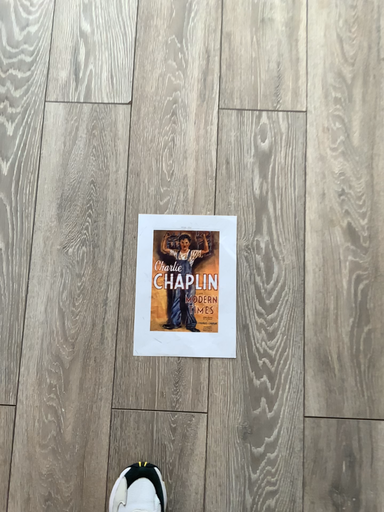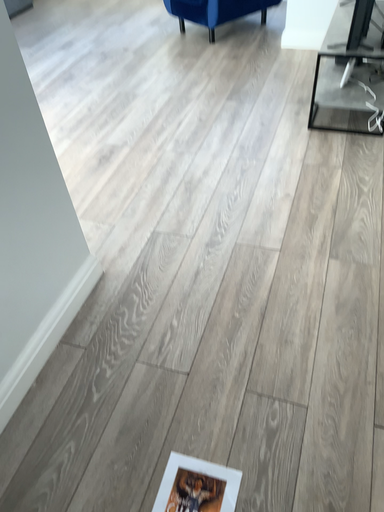
Question: Which way did the camera rotate in the video?

Choices:
 (A) rotated upward
 (B) rotated downward

Answer: (A)